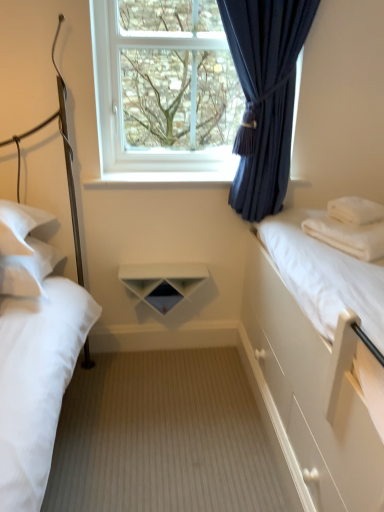
Question: Can you confirm if white soft pillow at right, the 1th pillow in the right-to-left sequence, is taller than white glossy shelf at center?

Choices:
 (A) no
 (B) yes

Answer: (B)

Question: Is white soft pillow at right, the 3th pillow when ordered from left to right, located outside white glossy shelf at center?

Choices:
 (A) no
 (B) yes

Answer: (B)

Question: From the image's perspective, does white soft pillow at right, the 3th pillow when ordered from left to right, appear higher than white glossy shelf at center?

Choices:
 (A) yes
 (B) no

Answer: (B)

Question: Does white soft pillow at right, the 3th pillow when ordered from left to right, have a larger size compared to white glossy shelf at center?

Choices:
 (A) yes
 (B) no

Answer: (B)

Question: From a real-world perspective, is white soft pillow at right, the 3th pillow when ordered from left to right, under white glossy shelf at center?

Choices:
 (A) no
 (B) yes

Answer: (B)

Question: Is white soft pillow at right, the 3th pillow when ordered from left to right, closer to the viewer compared to white glossy shelf at center?

Choices:
 (A) no
 (B) yes

Answer: (B)

Question: Can you confirm if white soft pillow at left, acting as the 3th pillow starting from the right, is positioned to the right of dark blue fabric at upper center?

Choices:
 (A) no
 (B) yes

Answer: (A)

Question: From a real-world perspective, is white soft pillow at left, acting as the 3th pillow starting from the right, positioned under dark blue fabric at upper center based on gravity?

Choices:
 (A) yes
 (B) no

Answer: (A)

Question: Is white soft pillow at left, acting as the 3th pillow starting from the right, outside dark blue fabric at upper center?

Choices:
 (A) no
 (B) yes

Answer: (B)

Question: Is white soft pillow at left, acting as the 3th pillow starting from the right, directly adjacent to dark blue fabric at upper center?

Choices:
 (A) yes
 (B) no

Answer: (B)

Question: Does white soft pillow at left, acting as the 3th pillow starting from the right, have a larger size compared to dark blue fabric at upper center?

Choices:
 (A) yes
 (B) no

Answer: (B)

Question: Considering the relative positions of white soft pillow at left, which ranks as the first pillow in left-to-right order, and dark blue fabric at upper center in the image provided, is white soft pillow at left, which ranks as the first pillow in left-to-right order, to the left of dark blue fabric at upper center from the viewer's perspective?

Choices:
 (A) no
 (B) yes

Answer: (B)

Question: Is white matte bed at left, which is the second bed in right-to-left order, outside white soft pillow at left, acting as the 3th pillow starting from the right?

Choices:
 (A) no
 (B) yes

Answer: (B)